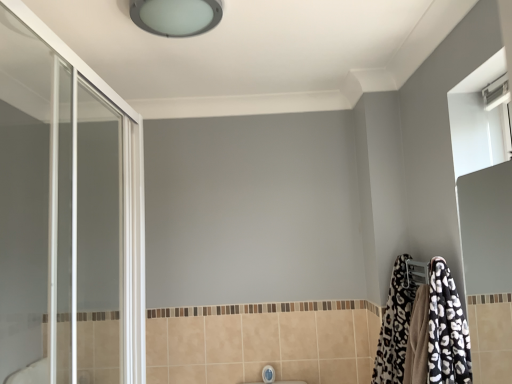
Question: From the image's perspective, does transparent glass screen door at left appear lower than black and white leopard print bathrobe at lower right?

Choices:
 (A) yes
 (B) no

Answer: (B)

Question: Can you confirm if transparent glass screen door at left is bigger than black and white leopard print bathrobe at lower right?

Choices:
 (A) yes
 (B) no

Answer: (A)

Question: From a real-world perspective, is transparent glass screen door at left on black and white leopard print bathrobe at lower right?

Choices:
 (A) yes
 (B) no

Answer: (A)

Question: Is transparent glass screen door at left to the left of black and white leopard print bathrobe at lower right from the viewer's perspective?

Choices:
 (A) no
 (B) yes

Answer: (B)

Question: Does transparent glass screen door at left have a lesser width compared to black and white leopard print bathrobe at lower right?

Choices:
 (A) no
 (B) yes

Answer: (B)

Question: Would you say transparent glass screen door at left is inside or outside black and white leopard print bathrobe at lower right?

Choices:
 (A) inside
 (B) outside

Answer: (B)

Question: Considering their positions, is transparent glass screen door at left located in front of or behind black and white leopard print bathrobe at lower right?

Choices:
 (A) behind
 (B) front

Answer: (B)

Question: From the image's perspective, is transparent glass screen door at left located above or below black and white leopard print bathrobe at lower right?

Choices:
 (A) above
 (B) below

Answer: (A)

Question: In the image, is transparent glass screen door at left on the left side or the right side of black and white leopard print bathrobe at lower right?

Choices:
 (A) left
 (B) right

Answer: (A)

Question: Choose the correct answer: Is satin white ceiling light at upper center inside transparent glass screen door at left or outside it?

Choices:
 (A) inside
 (B) outside

Answer: (B)

Question: Is satin white ceiling light at upper center in front of or behind transparent glass screen door at left in the image?

Choices:
 (A) front
 (B) behind

Answer: (B)

Question: In terms of width, does satin white ceiling light at upper center look wider or thinner when compared to transparent glass screen door at left?

Choices:
 (A) thin
 (B) wide

Answer: (B)

Question: From a real-world perspective, is satin white ceiling light at upper center positioned above or below transparent glass screen door at left?

Choices:
 (A) above
 (B) below

Answer: (A)

Question: Considering the positions of transparent glass screen door at left and satin white ceiling light at upper center in the image, is transparent glass screen door at left taller or shorter than satin white ceiling light at upper center?

Choices:
 (A) short
 (B) tall

Answer: (B)

Question: From the image's perspective, relative to satin white ceiling light at upper center, is transparent glass screen door at left above or below?

Choices:
 (A) below
 (B) above

Answer: (A)